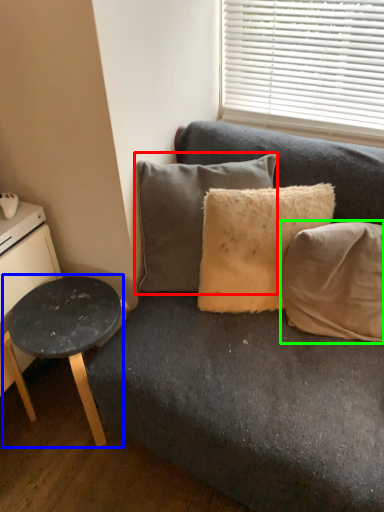
Question: Which is farther away from pillow (highlighted by a red box)? table (highlighted by a blue box) or pillow (highlighted by a green box)?

Choices:
 (A) table
 (B) pillow

Answer: (B)